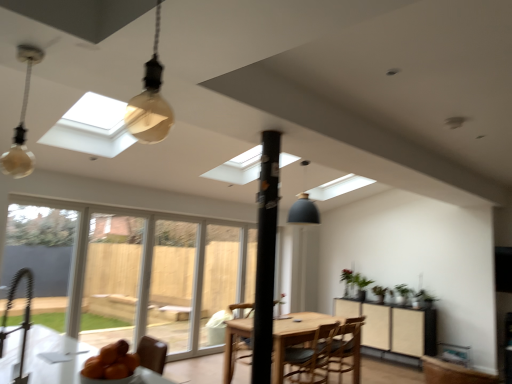
Question: Choose the correct answer: Is green matte plant at right inside clear glass door at center, the 2th screen door in the front-to-back sequence, or outside it?

Choices:
 (A) outside
 (B) inside

Answer: (A)

Question: From a real-world perspective, is green matte plant at right physically located above or below clear glass door at center, the second screen door positioned from the right?

Choices:
 (A) above
 (B) below

Answer: (A)

Question: Estimate the real-world distances between objects in this image. Which object is farther from the green matte plant at right?

Choices:
 (A) transparent plastic screen door at center, positioned as the first screen door in right-to-left order
 (B) black matte pole at center
 (C) matte black cabinet at center right
 (D) wooden chair at center, which ranks as the 1th chair in front-to-back order
 (E) wooden chair at center, placed as the first chair when sorted from back to front

Answer: (B)

Question: Which object is positioned farthest from the wooden chair at center, which ranks as the 1th chair in front-to-back order?

Choices:
 (A) matte gray pendant lamp at center, the 1th light fixture in the right-to-left sequence
 (B) clear glass screen door at left, the third screen door viewed from the back
 (C) transparent plastic screen door at center, positioned as the first screen door in right-to-left order
 (D) matte glass bulb at upper left
 (E) black matte pole at center

Answer: (D)